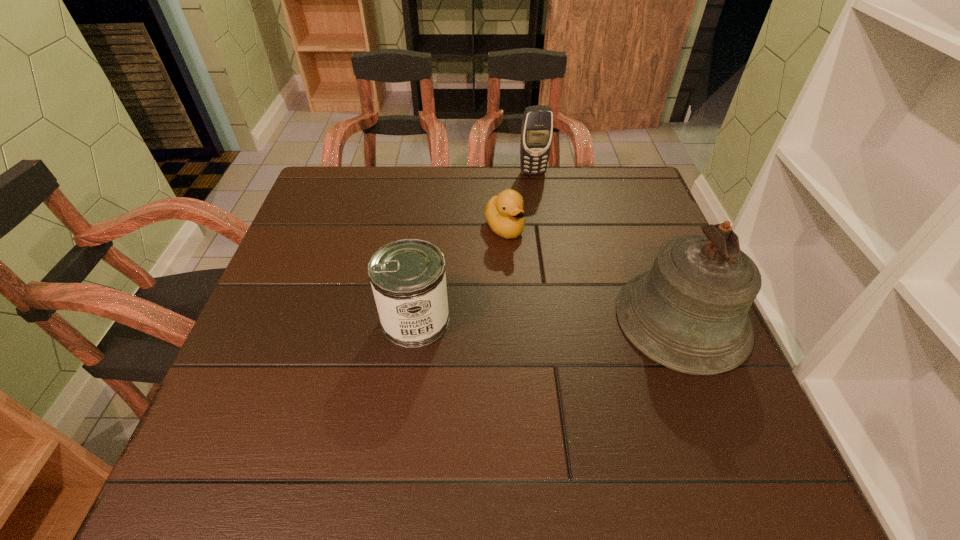
I want to click on vacant spot on the desktop that is between the leftmost object and the tallest object and is positioned on the front face of the farthest object, so click(579, 320).

Identify the location of free space on the desktop that is between the third tallest object and the bell and is positioned on the face of the shortest object. (581, 320).